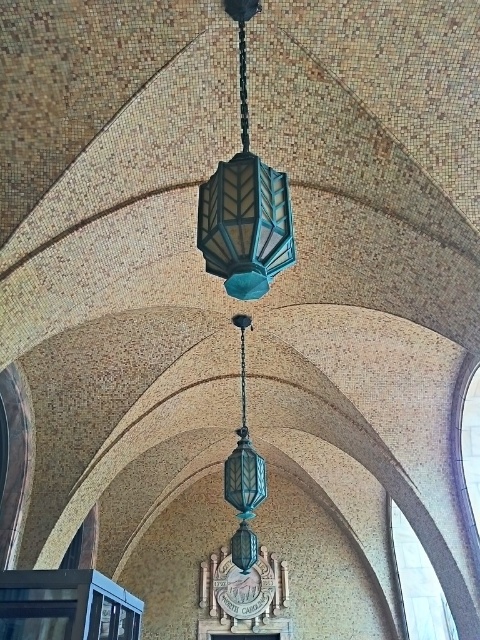
Can you confirm if teal glass lantern at center is bigger than teal glass pendant light at center?

Actually, teal glass lantern at center might be smaller than teal glass pendant light at center.

Does teal glass lantern at center have a greater height compared to teal glass pendant light at center?

Incorrect, teal glass lantern at center's height is not larger of teal glass pendant light at center's.

Is point (240, 38) closer to camera compared to point (248, 458)?

That is True.

Locate an element on the screen. Image resolution: width=480 pixels, height=640 pixels. teal glass lantern at center is located at coordinates (244, 204).